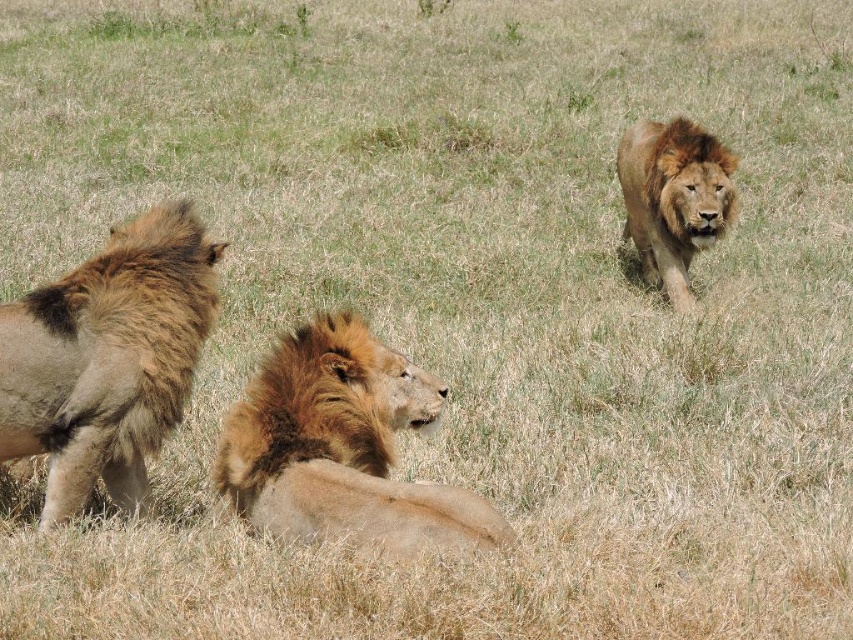
Question: Considering the real-world distances, which object is farthest from the golden brown fur lion at center?

Choices:
 (A) fuzzy brown lion at left
 (B) golden brown mane at upper right

Answer: (B)

Question: Estimate the real-world distances between objects in this image. Which object is closer to the golden brown mane at upper right?

Choices:
 (A) fuzzy brown lion at left
 (B) golden brown fur lion at center

Answer: (B)

Question: Which point is farther to the camera?

Choices:
 (A) fuzzy brown lion at left
 (B) golden brown mane at upper right

Answer: (B)

Question: Does fuzzy brown lion at left come behind golden brown fur lion at center?

Choices:
 (A) no
 (B) yes

Answer: (B)

Question: Does fuzzy brown lion at left have a greater width compared to golden brown fur lion at center?

Choices:
 (A) no
 (B) yes

Answer: (A)

Question: Can you confirm if golden brown fur lion at center is smaller than golden brown mane at upper right?

Choices:
 (A) no
 (B) yes

Answer: (B)